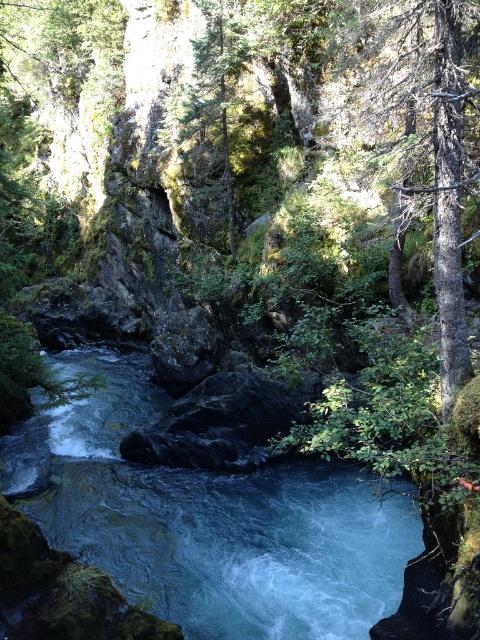
You are standing on the smooth bark tree at right and want to jump into the blue smooth water at center. Is the water within reach for a safe jump?

The blue smooth water at center is located below the smooth bark tree at right, so yes, you can safely jump into the blue smooth water at center from the smooth bark tree at right.

You are a hiker trying to cross the river. You see the blue smooth water at center and the smooth bark tree at right. Which object is closer to you, the hiker?

The blue smooth water at center is closer to you because the smooth bark tree at right is behind it.